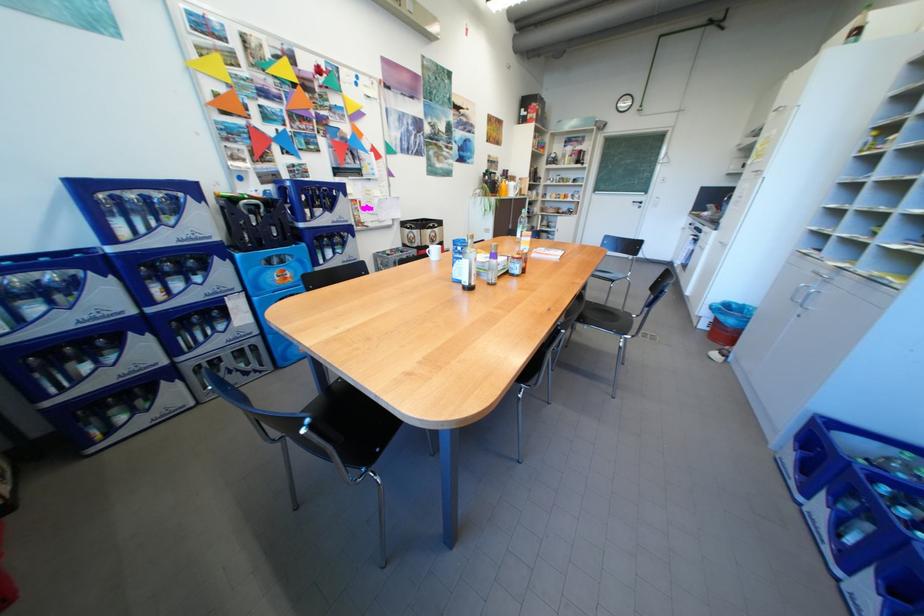
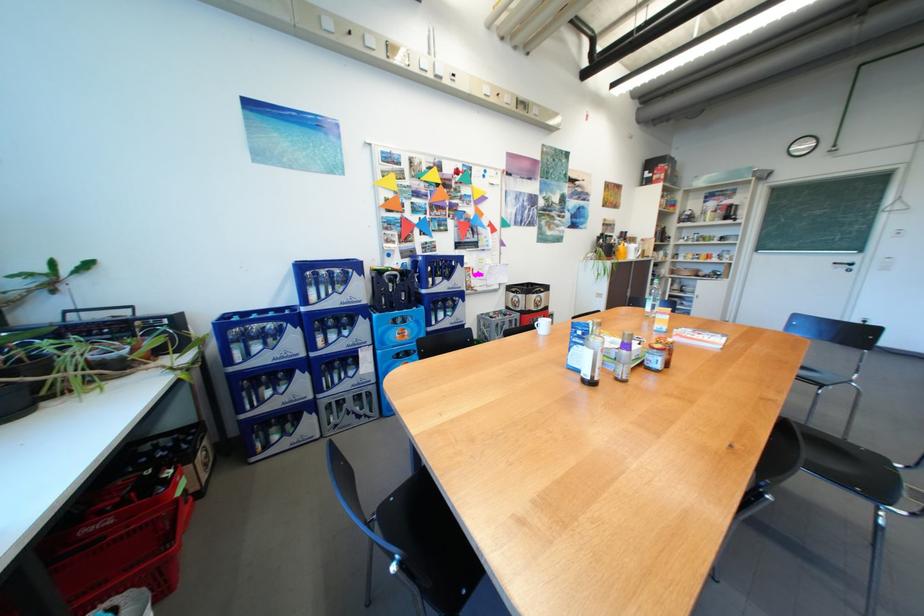
Question: Based on the continuous images, in which direction is the camera rotating? Reply with the corresponding letter.

Choices:
 (A) Left
 (B) Right
 (C) Up
 (D) Down

Answer: (A)